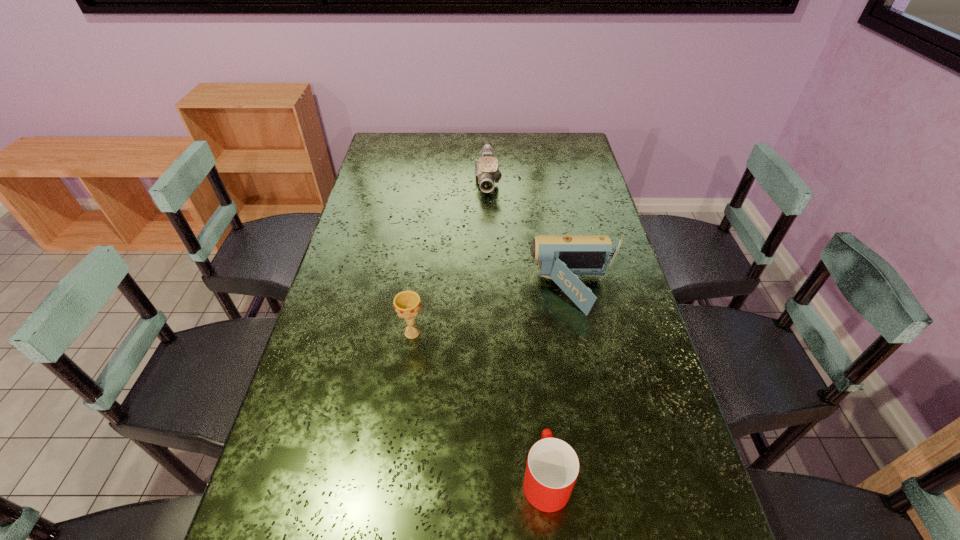
Locate an element on the screen. The image size is (960, 540). object that stands as the third closest to the leftmost object is located at coordinates (487, 171).

Identify which object is the nearest to the nearest object. Please provide its 2D coordinates. Your answer should be formatted as a tuple, i.e. [(x, y)], where the tuple contains the x and y coordinates of a point satisfying the conditions above.

[(561, 258)]

This screenshot has height=540, width=960. Identify the location of free space that satisfies the following two spatial constraints: 1. on the side of the nearer camcorder with the flip-out screen; 2. on the front side of the second nearest object. (583, 333).